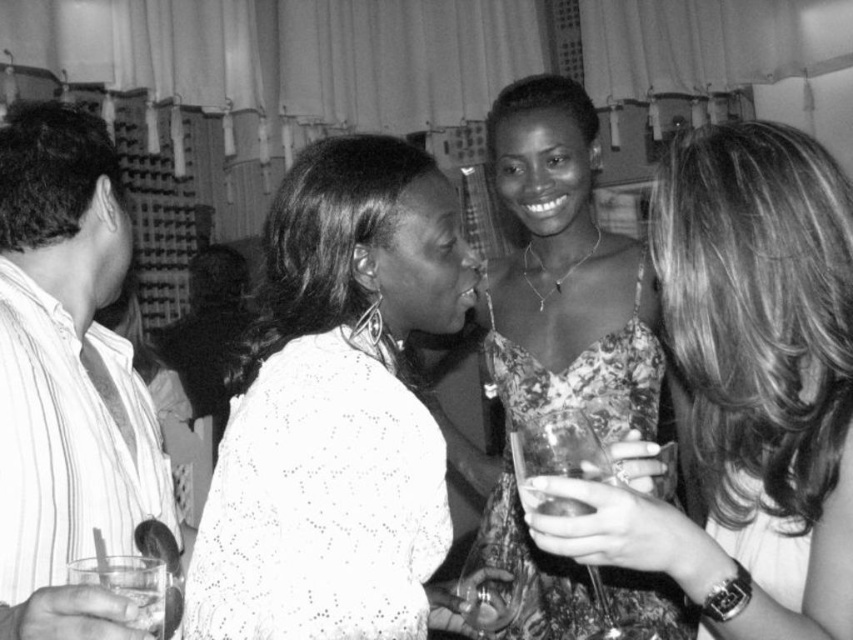
Question: Considering the real-world distances, which object is closest to the floral dress at center?

Choices:
 (A) transparent plastic cup at center
 (B) clear glass at lower left

Answer: (A)

Question: From the image, what is the correct spatial relationship of floral dress at center in relation to striped cotton shirt at left?

Choices:
 (A) below
 (B) above

Answer: (B)

Question: Which point is closer to the camera taking this photo?

Choices:
 (A) (550, 445)
 (B) (132, 388)

Answer: (A)

Question: Where is striped cotton shirt at left located in relation to transparent plastic cup at center in the image?

Choices:
 (A) right
 (B) left

Answer: (B)

Question: Does floral dress at center appear over translucent glass at lower center?

Choices:
 (A) yes
 (B) no

Answer: (A)

Question: Which object is closer to the camera taking this photo?

Choices:
 (A) printed fabric dress at center
 (B) striped cotton shirt at left

Answer: (B)